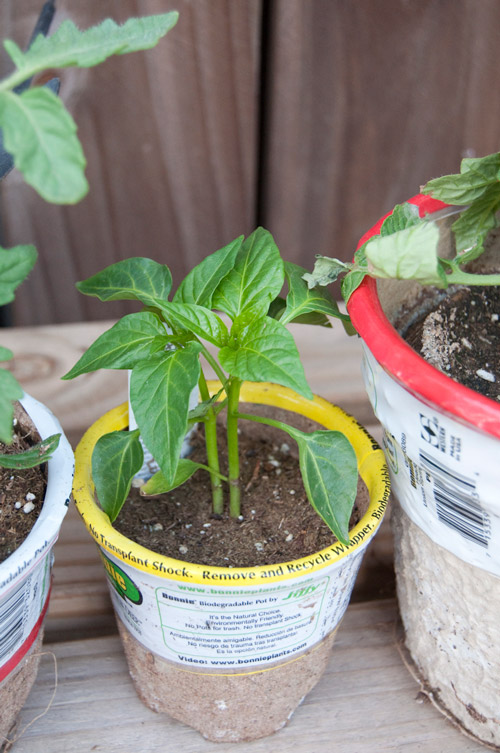
The image size is (500, 753). I want to click on wood shelf, so click(x=351, y=700).